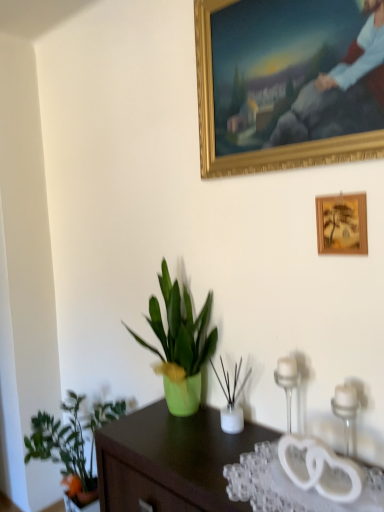
The image size is (384, 512). Find the location of `vacant area to the left of white glass candle holder at right, placed as the second candle holder when sorted from left to right`. vacant area to the left of white glass candle holder at right, placed as the second candle holder when sorted from left to right is located at coordinates (273, 475).